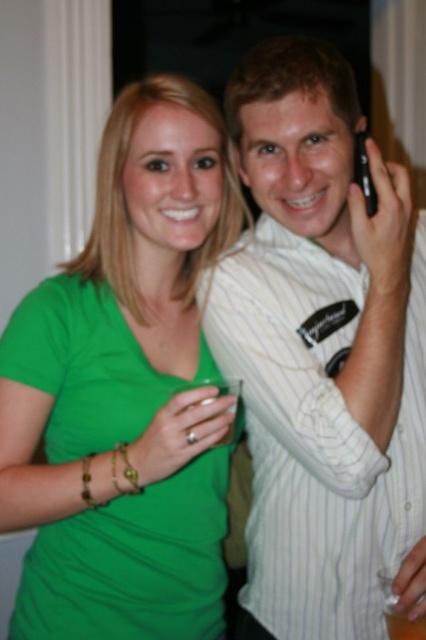
Question: Which of the following is the farthest from the observer?

Choices:
 (A) (287, 189)
 (B) (22, 358)
 (C) (403, 634)

Answer: (B)

Question: Which of the following is the closest to the observer?

Choices:
 (A) (359, 560)
 (B) (414, 621)
 (C) (377, 198)
 (D) (71, 273)

Answer: (B)

Question: Does green matte shirt at center appear under translucent glass at upper right?

Choices:
 (A) yes
 (B) no

Answer: (B)

Question: Is green matte shirt at center thinner than black plastic phone at upper right?

Choices:
 (A) yes
 (B) no

Answer: (B)

Question: Is green matte shirt at center positioned at the back of black plastic phone at upper right?

Choices:
 (A) yes
 (B) no

Answer: (B)

Question: Which point is farther to the camera?

Choices:
 (A) white striped shirt at upper right
 (B) black plastic phone at upper right
 (C) green matte shirt at center

Answer: (B)